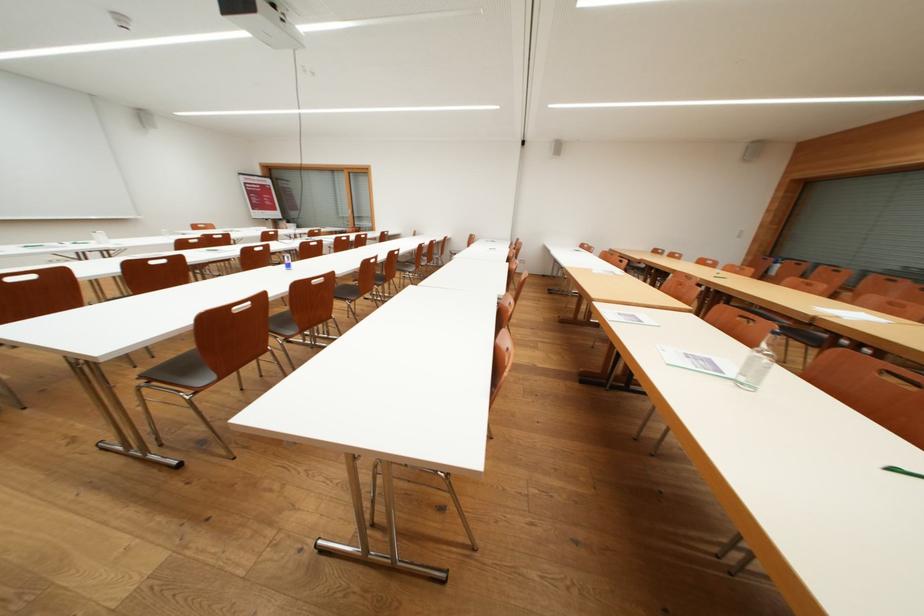
Locate an element on the screen. Image resolution: width=924 pixels, height=616 pixels. blue can is located at coordinates (286, 261).